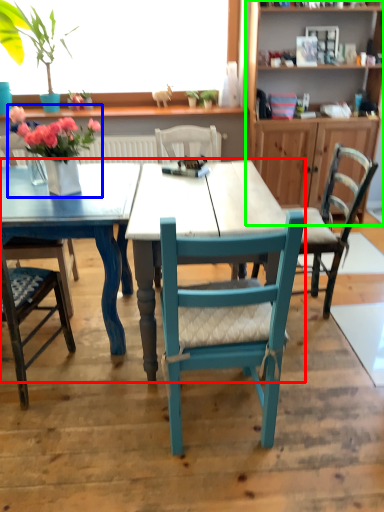
Question: Which object is the closest to the kitchen & dining room table (highlighted by a red box)? Choose among these: floral arrangement (highlighted by a blue box) or cabinetry (highlighted by a green box).

Choices:
 (A) floral arrangement
 (B) cabinetry

Answer: (A)